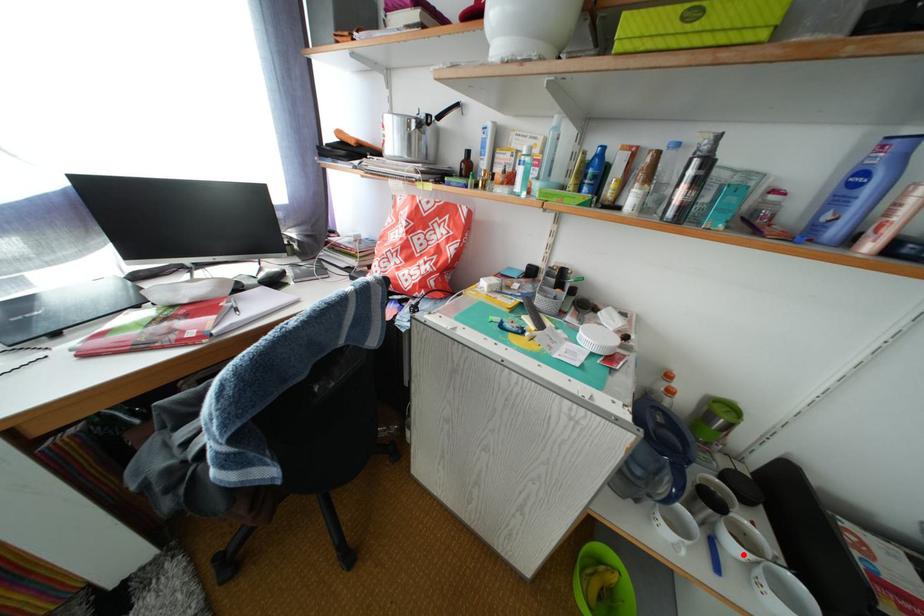
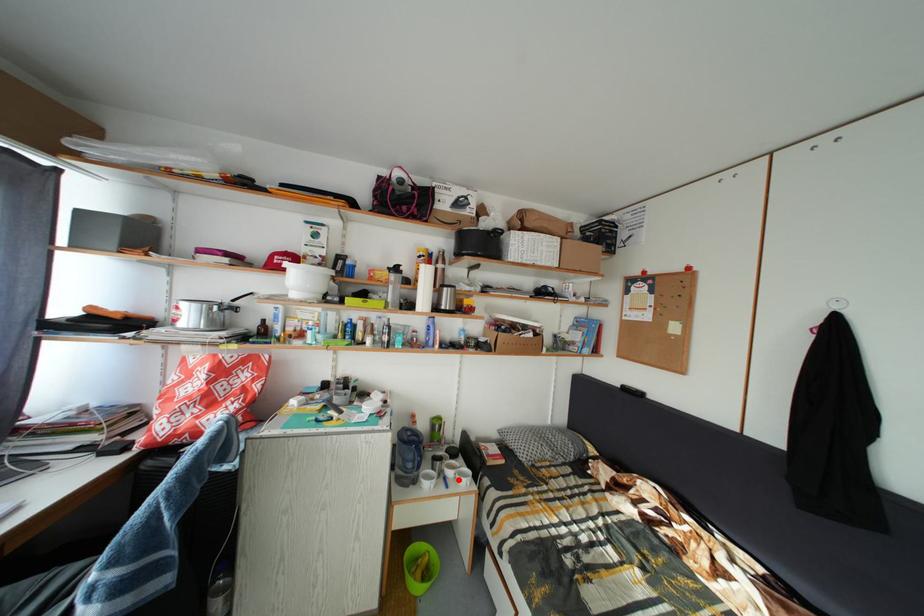
I am providing you with two images of the same scene from different viewpoints. A red point is marked on the first image and another point is marked on the second image. Is the marked point in image1 the same physical position as the marked point in image2?

Yes